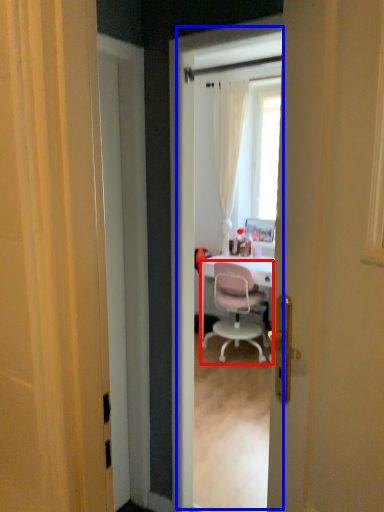
Question: Among these objects, which one is farthest to the camera, chair (highlighted by a red box) or screen door (highlighted by a blue box)?

Choices:
 (A) chair
 (B) screen door

Answer: (A)